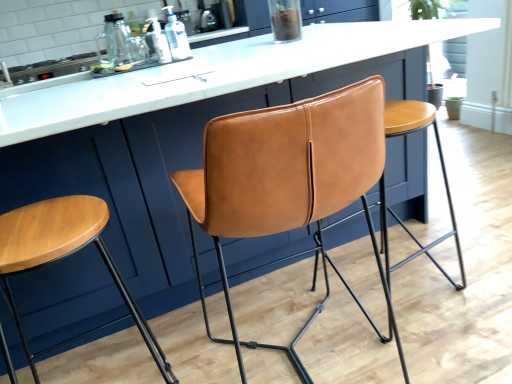
What are the coordinates of `empty space that is to the right of translucent plastic bottle at upper center, marked as the second bottle in a right-to-left arrangement` in the screenshot? It's located at (203, 51).